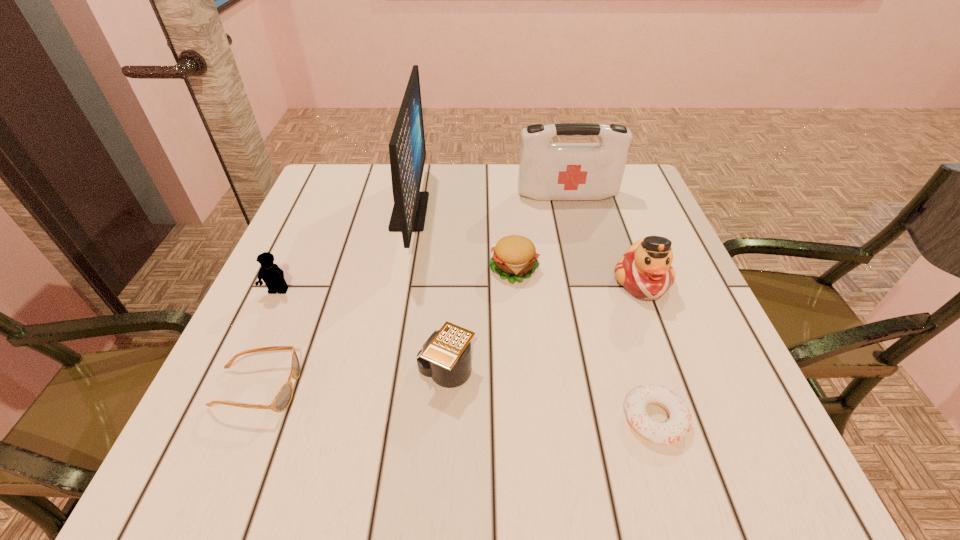
I want to click on Lego that is positioned at the left edge, so click(x=273, y=276).

I want to click on sunglasses at the left edge, so click(282, 400).

At what (x,y) coordinates should I click in order to perform the action: click on the first-aid kit present at the right edge. Please return your answer as a coordinate pair (x, y). This screenshot has width=960, height=540. Looking at the image, I should click on (547, 171).

The image size is (960, 540). I want to click on duck that is positioned at the right edge, so click(x=645, y=271).

The width and height of the screenshot is (960, 540). What are the coordinates of `doughnut at the right edge` in the screenshot? It's located at (679, 423).

What are the coordinates of `object at the far right corner` in the screenshot? It's located at (547, 171).

At what (x,y) coordinates should I click in order to perform the action: click on object that is positioned at the near right corner. Please return your answer as a coordinate pair (x, y). The height and width of the screenshot is (540, 960). Looking at the image, I should click on (679, 423).

Where is `free region at the far edge of the desktop`? Image resolution: width=960 pixels, height=540 pixels. free region at the far edge of the desktop is located at coordinates (479, 204).

In the image, there is a desktop. In order to click on vacant space at the left edge in this screenshot , I will do `click(257, 353)`.

In the image, there is a desktop. Where is `vacant space at the right edge`? This screenshot has width=960, height=540. vacant space at the right edge is located at coordinates (642, 342).